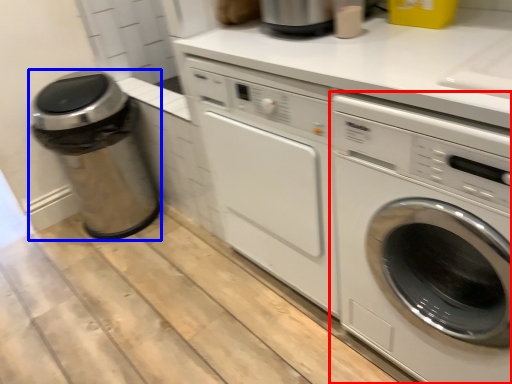
Question: Which point is closer to the camera, washing machine (highlighted by a red box) or garbage (highlighted by a blue box)?

Choices:
 (A) washing machine
 (B) garbage

Answer: (A)